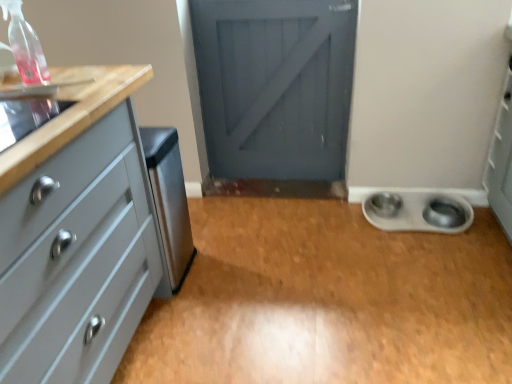
This screenshot has height=384, width=512. What are the coordinates of `vacant space in front of silver metallic bowls at lower right, which ranks as the 1th appliance in right-to-left order` in the screenshot? It's located at (435, 259).